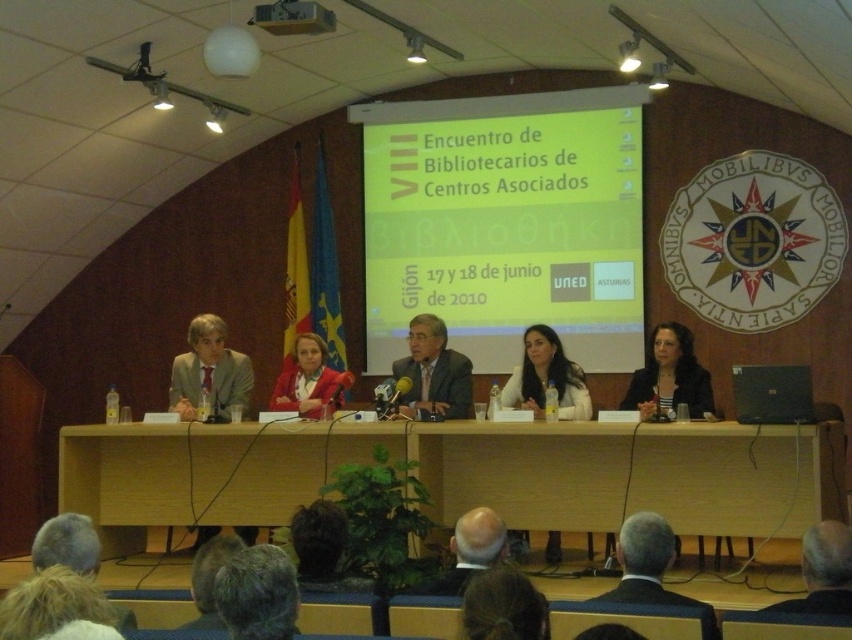
Does wooden at center have a larger size compared to black plastic laptop at center?

Indeed, wooden at center has a larger size compared to black plastic laptop at center.

Between wooden at center and black plastic laptop at center, which one has less height?

black plastic laptop at center

What do you see at coordinates (205, 472) in the screenshot? Image resolution: width=852 pixels, height=640 pixels. I see `wooden at center` at bounding box center [205, 472].

Image resolution: width=852 pixels, height=640 pixels. In order to click on wooden at center in this screenshot , I will do `click(205, 472)`.

Can you confirm if smooth white blouse at center is wider than gray hair at center?

Incorrect, smooth white blouse at center's width does not surpass gray hair at center's.

Between smooth white blouse at center and gray hair at center, which one is positioned lower?

gray hair at center

At what (x,y) coordinates should I click in order to perform the action: click on smooth white blouse at center. Please return your answer as a coordinate pair (x, y). The image size is (852, 640). Looking at the image, I should click on (545, 378).

Who is shorter, wooden table at center or black plastic laptop at center?

black plastic laptop at center is shorter.

Can you confirm if wooden table at center is positioned below black plastic laptop at center?

Yes, wooden table at center is below black plastic laptop at center.

Is point (753, 506) closer to camera compared to point (751, 417)?

No, it is behind (751, 417).

This screenshot has width=852, height=640. Find the location of `wooden table at center`. wooden table at center is located at coordinates (463, 472).